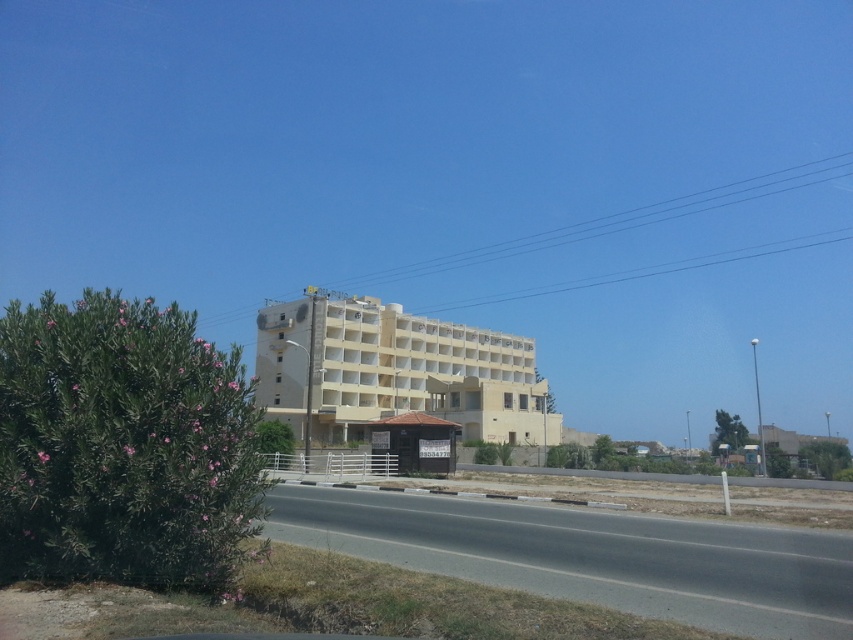
Question: Does asphalt road at center appear over beige concrete building at center?

Choices:
 (A) no
 (B) yes

Answer: (A)

Question: Which point appears closest to the camera in this image?

Choices:
 (A) (337, 419)
 (B) (408, 566)

Answer: (B)

Question: Can you confirm if asphalt road at center is bigger than beige concrete building at center?

Choices:
 (A) no
 (B) yes

Answer: (A)

Question: Does asphalt road at center appear under beige concrete building at center?

Choices:
 (A) no
 (B) yes

Answer: (B)